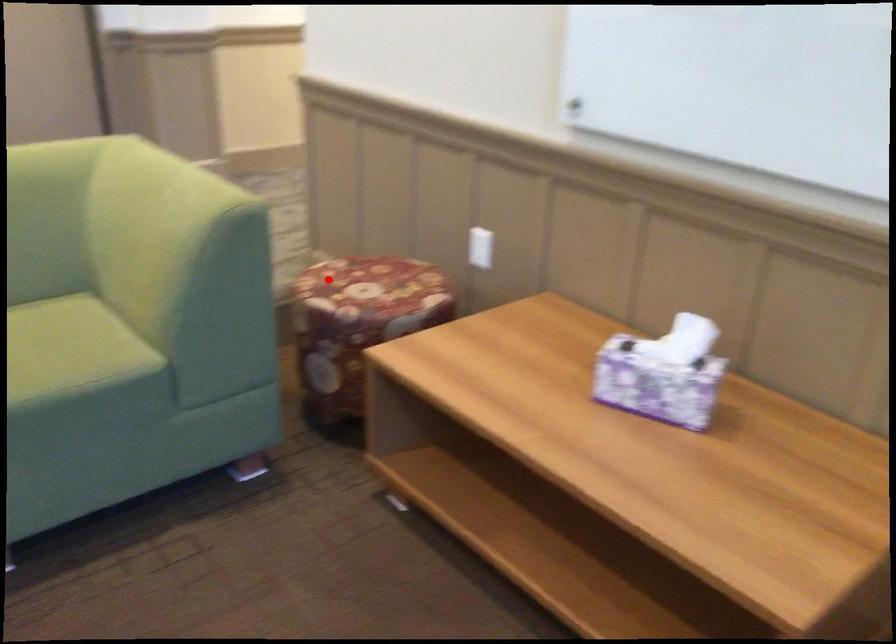
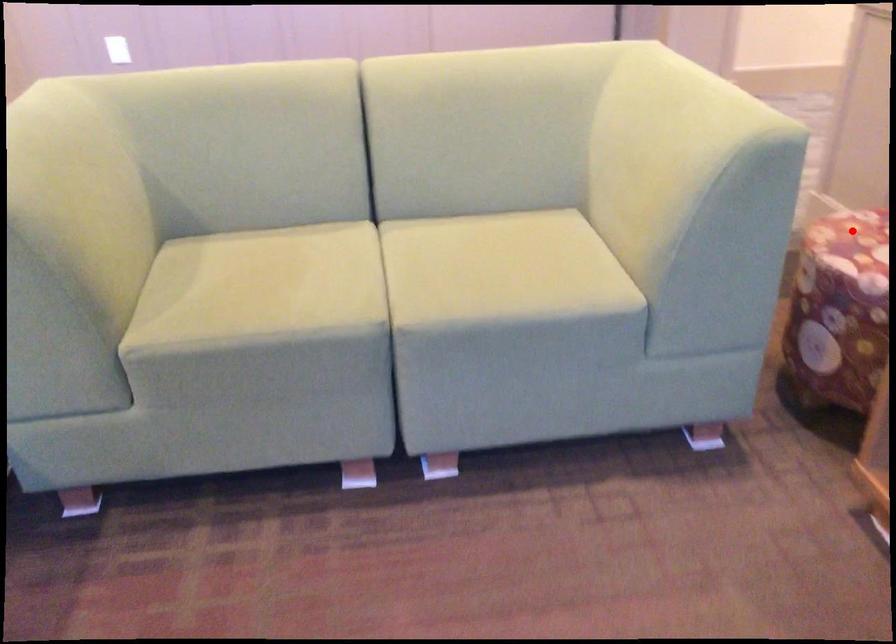
I am providing you with two images of the same scene from different viewpoints. A red point is marked on the first image and another point is marked on the second image. Does the point marked in image1 correspond to the same location as the one in image2?

Yes